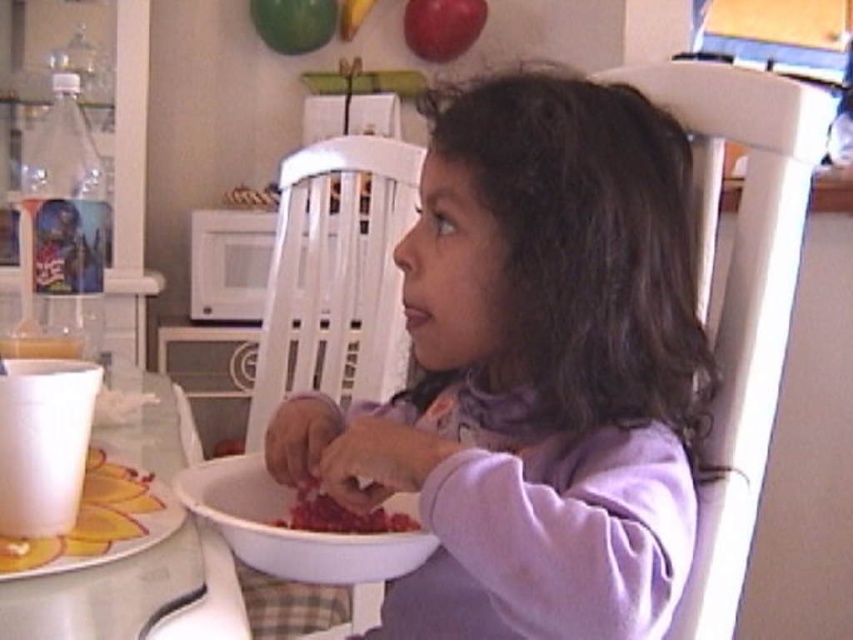
Does red matte apple at upper center appear on the right side of green matte apple at upper center?

Yes, red matte apple at upper center is to the right of green matte apple at upper center.

Is point (474, 3) less distant than point (276, 49)?

No, (474, 3) is further to viewer.

Where is `red matte apple at upper center`? The image size is (853, 640). red matte apple at upper center is located at coordinates (442, 26).

Which is in front, point (256, 449) or point (444, 20)?

Point (256, 449)

Does point (386, 392) lie in front of point (416, 0)?

Yes.

Find the location of a particular element. This screenshot has height=640, width=853. white plastic chair at center is located at coordinates (323, 355).

Between white plastic table at lower left and meaty red at bowl center, which one is positioned higher?

white plastic table at lower left is higher up.

Does point (132, 572) come in front of point (341, 522)?

Yes, it is.

Who is more forward, (137, 429) or (363, 515)?

Positioned in front is point (363, 515).

Image resolution: width=853 pixels, height=640 pixels. What are the coordinates of `white plastic table at lower left` in the screenshot? It's located at (134, 595).